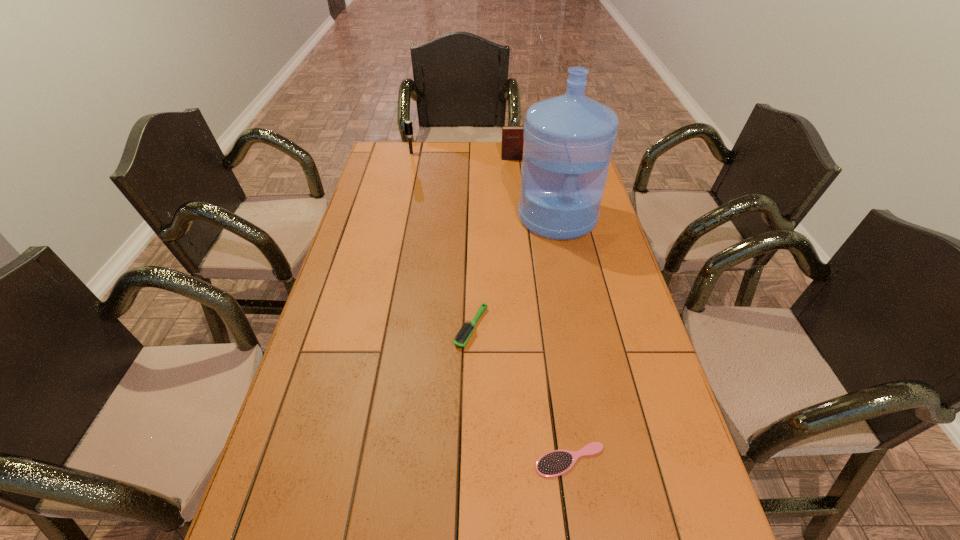
At what (x,y) coordinates should I click in order to perform the action: click on vacant space at the right edge of the desktop. Please return your answer as a coordinate pair (x, y). Looking at the image, I should click on (621, 267).

I want to click on vacant space at the far left corner of the desktop, so click(381, 147).

Image resolution: width=960 pixels, height=540 pixels. I want to click on empty space that is in between the shortest hairbrush and the third farthest object, so click(564, 339).

Locate an element on the screen. This screenshot has height=540, width=960. vacant area that lies between the shortest hairbrush and the farthest object is located at coordinates (491, 307).

Locate an element on the screen. free space between the tallest hairbrush and the second hairbrush from right to left is located at coordinates (442, 240).

You are a GUI agent. You are given a task and a screenshot of the screen. Output one action in this format:
    pyautogui.click(x=<x>, y=<y>)
    Task: Click on the unoccupied position between the shortest object and the fourth nearest object
    This screenshot has width=960, height=540.
    Given the screenshot: What is the action you would take?
    pyautogui.click(x=540, y=309)

Identify the location of vacant point located between the shortest object and the second hairbrush from right to left. Image resolution: width=960 pixels, height=540 pixels. (520, 394).

Find the location of `object that stands as the third closest to the diary`. object that stands as the third closest to the diary is located at coordinates (462, 337).

Find the location of a particular element. object that ranks as the fourth closest to the farthest hairbrush is located at coordinates (555, 463).

Locate an element on the screen. the closest hairbrush to the farthest object is located at coordinates (462, 337).